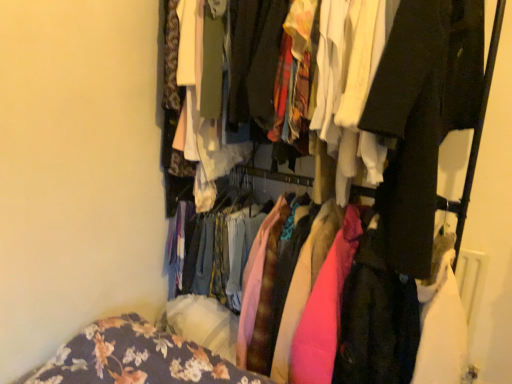
What is the approximate height of matte fabric clothes at center?

It is 37.09 inches.

Measure the distance between point (419, 70) and camera.

1.19 meters.

Where is `matte fabric clothes at center`? The image size is (512, 384). matte fabric clothes at center is located at coordinates (423, 23).

Image resolution: width=512 pixels, height=384 pixels. What do you see at coordinates (423, 23) in the screenshot?
I see `matte fabric clothes at center` at bounding box center [423, 23].

The width and height of the screenshot is (512, 384). I want to click on matte fabric clothes at center, so click(x=423, y=23).